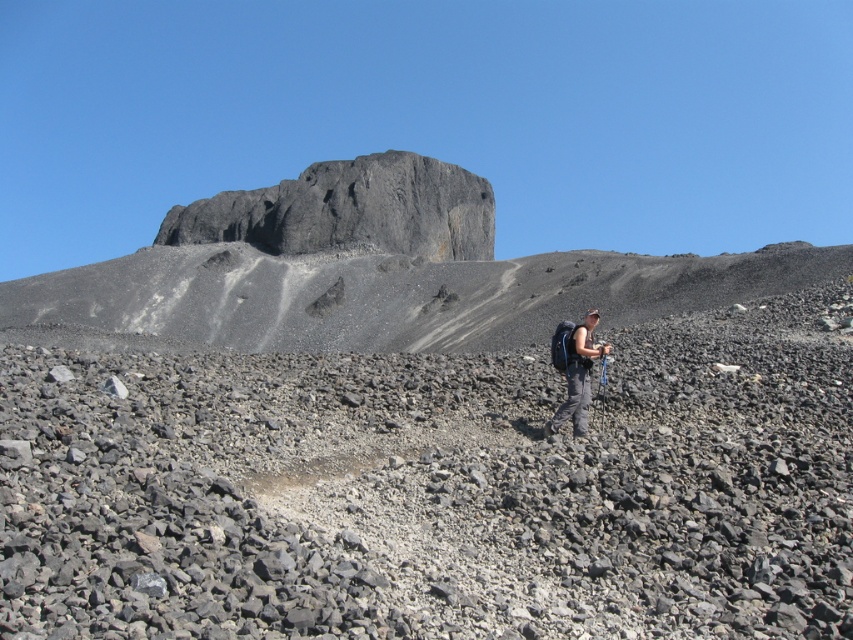
Question: Among these points, which one is farthest from the camera?

Choices:
 (A) (689, 422)
 (B) (589, 330)
 (C) (344, 212)

Answer: (C)

Question: Is gray gravelly rocks at center above matte gray backpack at center?

Choices:
 (A) yes
 (B) no

Answer: (B)

Question: Among these objects, which one is nearest to the camera?

Choices:
 (A) gray gravelly rocks at center
 (B) gray/dark rock formation at upper center
 (C) matte gray backpack at center
 (D) dark gray rock formation at upper center

Answer: (A)

Question: Is dark gray rock formation at upper center positioned before gray/dark rock formation at upper center?

Choices:
 (A) yes
 (B) no

Answer: (A)

Question: Observing the image, what is the correct spatial positioning of gray gravelly rocks at center in reference to matte gray backpack at center?

Choices:
 (A) below
 (B) above

Answer: (A)

Question: Which object is farther from the camera taking this photo?

Choices:
 (A) dark gray rock formation at upper center
 (B) gray/dark rock formation at upper center

Answer: (B)